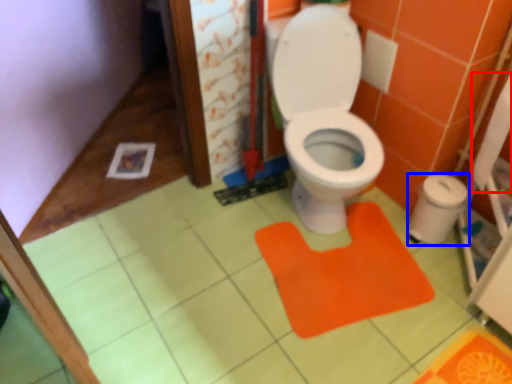
Question: Which object appears farthest to the camera in this image, toilet paper (highlighted by a red box) or potty (highlighted by a blue box)?

Choices:
 (A) toilet paper
 (B) potty

Answer: (B)